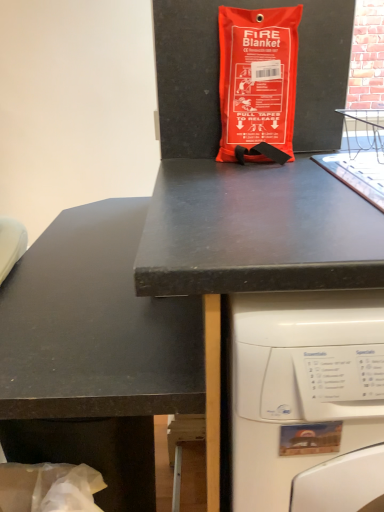
The height and width of the screenshot is (512, 384). Identify the location of free point above black matte counter top at center (from a real-world perspective). (92, 262).